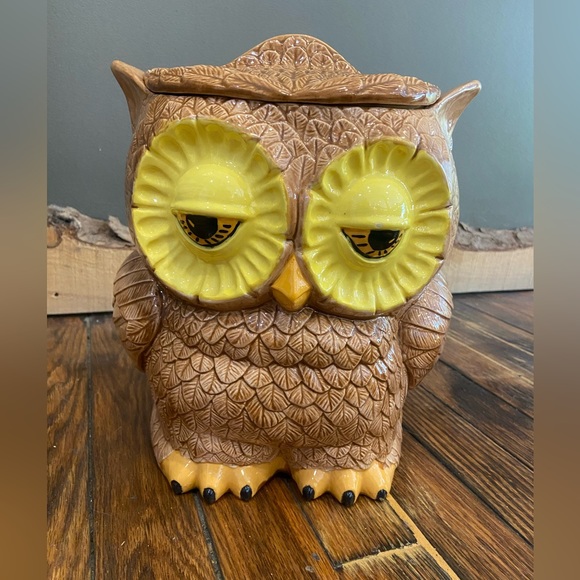
Locate an element on the screen. The width and height of the screenshot is (580, 580). wall is located at coordinates (494, 140), (56, 130).